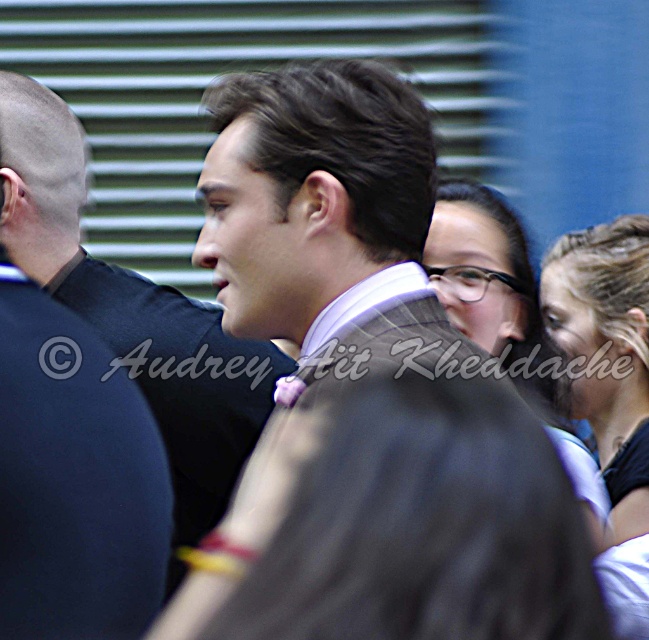
You are a photographer at a formal event. You need to adjust the camera focus to capture both the matte gray suit at center and the matte black hair at upper center clearly. Given that the camera has a depth of field that can cover 20 inches, will both subjects be in focus?

The matte gray suit at center and the matte black hair at upper center are 18.48 inches apart from each other. Since the depth of field can cover 20 inches, both subjects will be in focus.

You are standing at the origin point of the image coordinate system. Where is the satin brown suit at center located in terms of coordinates?

The satin brown suit at center is located at coordinates point (365, 394).

Based on the photo, you are a photographer at a formal event. You need to adjust the lighting so that the matte gray suit at center and the matte black hair at upper center are both well illuminated. Based on their positions, which object should you focus the light on first to ensure both are properly lit?

The matte gray suit at center is positioned on the left side of matte black hair at upper center. To ensure both are properly lit, focus the light first on the matte black hair at upper center since it is closer to the center of the image and the matte gray suit can be adjusted accordingly.